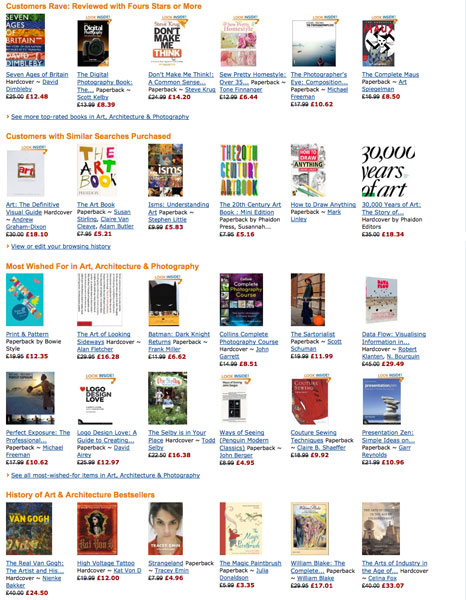
Image resolution: width=466 pixels, height=600 pixels. I want to click on columns on the left, so click(x=31, y=517), click(x=99, y=525), click(x=33, y=388), click(x=89, y=404), click(x=27, y=289), click(x=93, y=298), click(x=29, y=166), click(x=95, y=168), click(x=30, y=37), click(x=86, y=42).